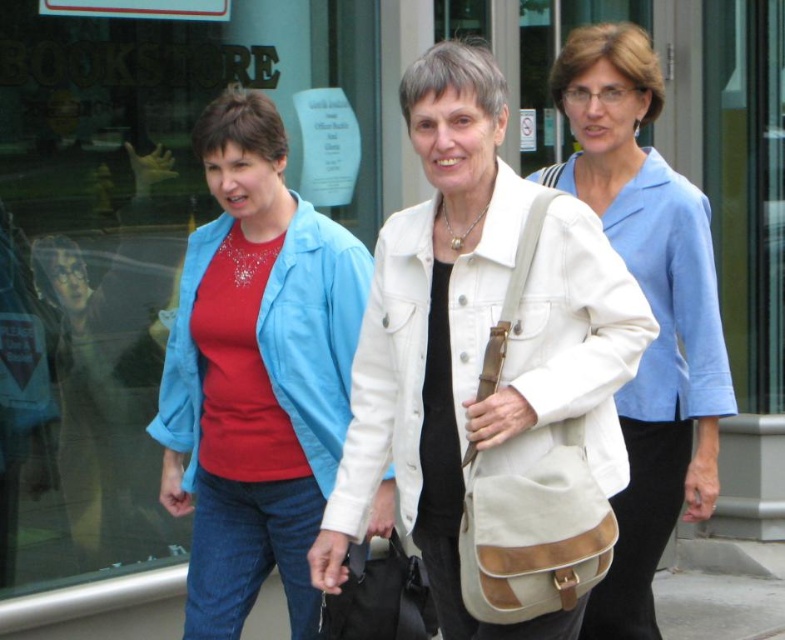
Which is above, white canvas bag at center or matte beige bag at center?

matte beige bag at center is above.

Image resolution: width=785 pixels, height=640 pixels. Identify the location of white canvas bag at center. (476, 337).

Locate an element on the screen. The height and width of the screenshot is (640, 785). white canvas bag at center is located at coordinates (476, 337).

Locate an element on the screen. The image size is (785, 640). matte beige bag at center is located at coordinates (650, 307).

Does point (553, 100) come farther from viewer compared to point (652, 362)?

Yes, it is behind point (652, 362).

I want to click on matte beige bag at center, so click(x=650, y=307).

Does white canvas bag at center have a smaller size compared to white canvas jacket at center?

No.

Find the location of a particular element. white canvas bag at center is located at coordinates (476, 337).

What do you see at coordinates (476, 337) in the screenshot? Image resolution: width=785 pixels, height=640 pixels. I see `white canvas bag at center` at bounding box center [476, 337].

Find the location of a particular element. white canvas bag at center is located at coordinates (476, 337).